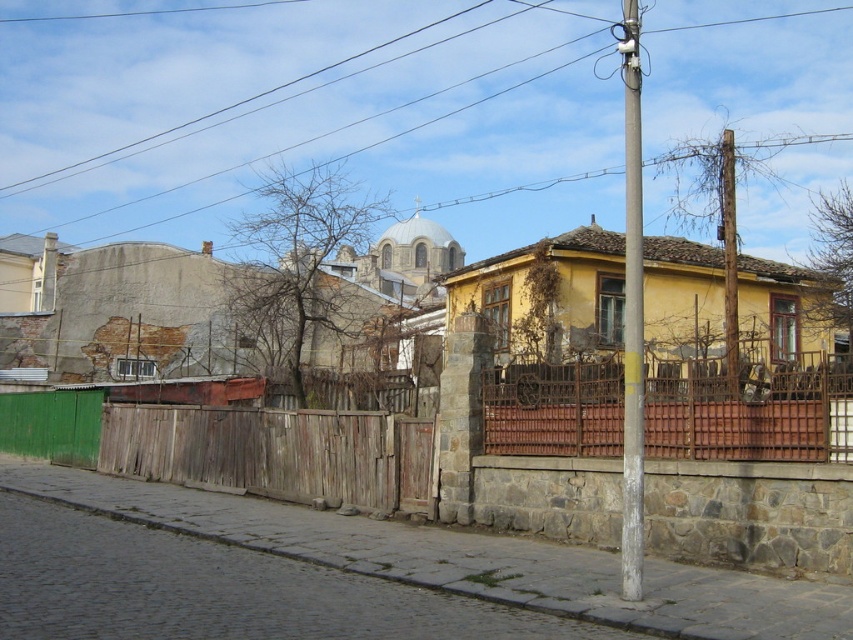
You are a painter who needs to decide whether to use a ladder or a step stool. You need to paint the rusty metal fence at center and the wooden pole at right. Based on their heights, which tool should you use for each object?

The rusty metal fence at center has a lesser height compared to wooden pole at right. Therefore, you can use a step stool for the rusty metal fence at center and a ladder for the wooden pole at right.

You are a delivery person trying to find the correct address on the cobblestone street. You see two poles at the right side of the yellow house. Which pole is closer to the yellow house, the white painted wood pole at right or the wooden pole at right?

The white painted wood pole at right is positioned on the left side of wooden pole at right, so the white painted wood pole at right is closer to the yellow house.